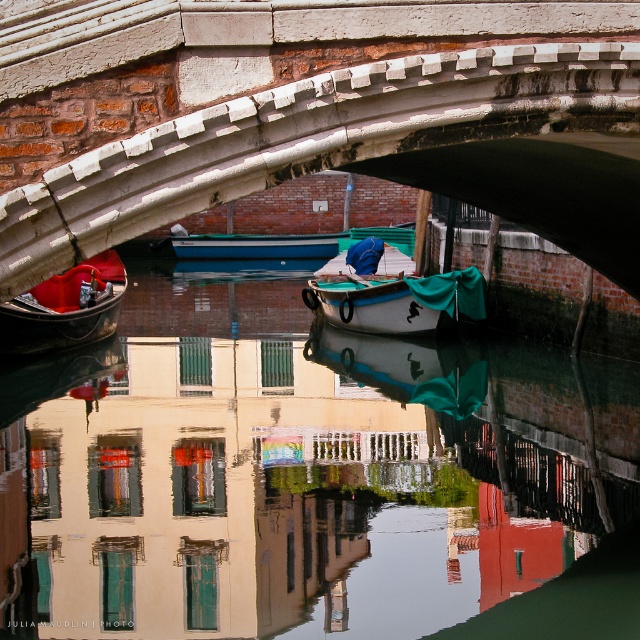
You are standing on the stone bridge and looking down at the canal. There is a point at coordinates (x=305, y=477). What is located at that point?

The transparent water at center is located at point (x=305, y=477).

You are an architect designing a miniature model of this canal scene. The white stone arch bridge at center must be scaled down to fit within a 10cm height limit. Given that the matte black gondola at left is 15cm in length in the model, will the bridge still appear proportionally smaller than the gondola?

The white stone arch bridge at center is smaller than the matte black gondola at left in reality. In the model, if the gondola is 15cm long, the bridge must be scaled down to maintain its smaller size. However, since the bridge has a height constraint of 10cm, its actual scaled dimensions may vary depending on the model scale. To ensure proportionality, the bridge should be proportionally smaller than the 15cm gondola while adhering to the height limit.